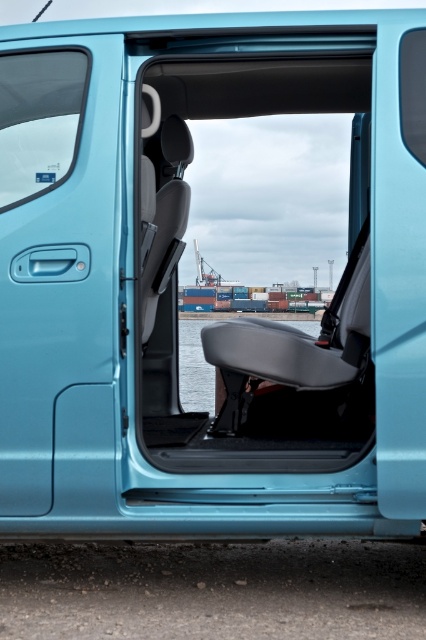
Is point (0, 474) positioned before point (201, 358)?

Yes.

Can you confirm if light blue metallic door at left is thinner than transparent water at seat center?

Yes, light blue metallic door at left is thinner than transparent water at seat center.

Which is behind, point (65, 417) or point (180, 364)?

Positioned behind is point (180, 364).

What are the coordinates of `light blue metallic door at left` in the screenshot? It's located at (57, 272).